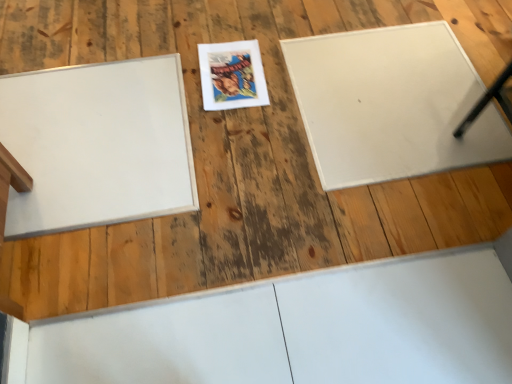
Locate an element on the screen. This screenshot has width=512, height=384. empty space that is in between matte paper comic book at center and white matte board at left, which appears as the 2th bulletin board when viewed from the right is located at coordinates (205, 119).